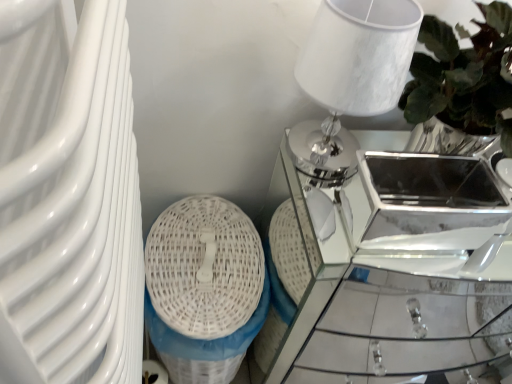
Question: Is white marble table lamp at upper right to the left of white wicker basket at lower left from the viewer's perspective?

Choices:
 (A) no
 (B) yes

Answer: (A)

Question: Is white marble table lamp at upper right shorter than white wicker basket at lower left?

Choices:
 (A) yes
 (B) no

Answer: (A)

Question: Does white marble table lamp at upper right appear on the right side of white wicker basket at lower left?

Choices:
 (A) no
 (B) yes

Answer: (B)

Question: From a real-world perspective, is white marble table lamp at upper right on top of white wicker basket at lower left?

Choices:
 (A) yes
 (B) no

Answer: (A)

Question: From the image's perspective, is white marble table lamp at upper right below white wicker basket at lower left?

Choices:
 (A) yes
 (B) no

Answer: (B)

Question: Is white marble table lamp at upper right facing away from white wicker basket at lower left?

Choices:
 (A) yes
 (B) no

Answer: (B)

Question: Is white wicker basket at lower left far away from mirror glass table at center?

Choices:
 (A) no
 (B) yes

Answer: (A)

Question: Does white wicker basket at lower left have a lesser width compared to mirror glass table at center?

Choices:
 (A) no
 (B) yes

Answer: (B)

Question: Is white wicker basket at lower left located outside mirror glass table at center?

Choices:
 (A) no
 (B) yes

Answer: (B)

Question: Does white wicker basket at lower left have a smaller size compared to mirror glass table at center?

Choices:
 (A) no
 (B) yes

Answer: (B)

Question: From the image's perspective, does white wicker basket at lower left appear lower than mirror glass table at center?

Choices:
 (A) yes
 (B) no

Answer: (A)

Question: From a real-world perspective, is white wicker basket at lower left physically above mirror glass table at center?

Choices:
 (A) yes
 (B) no

Answer: (B)

Question: Is white wicker basket at lower left wider than white marble table lamp at upper right?

Choices:
 (A) no
 (B) yes

Answer: (B)